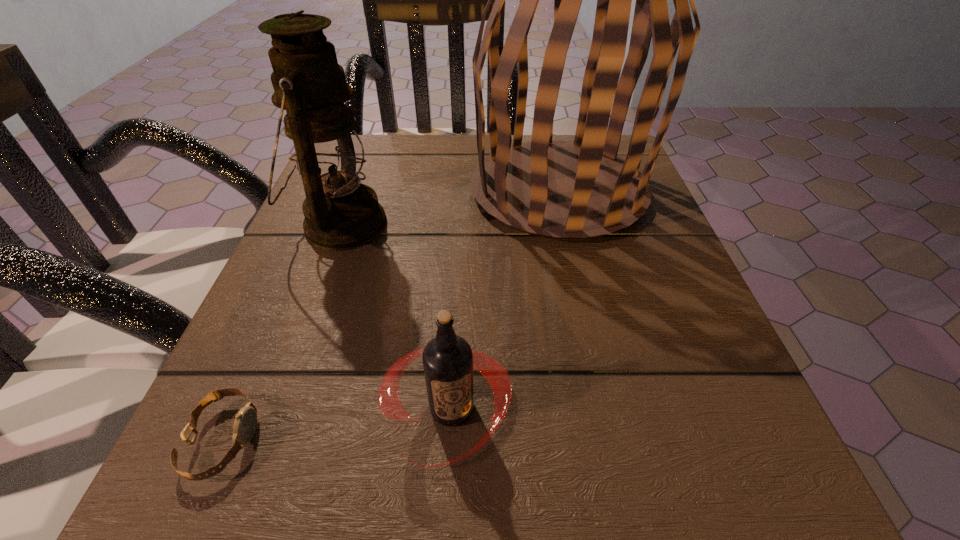
The image size is (960, 540). I want to click on the tallest object, so click(x=561, y=190).

Where is `oil lamp`? This screenshot has height=540, width=960. oil lamp is located at coordinates (341, 213).

You are a GUI agent. You are given a task and a screenshot of the screen. Output one action in this format:
    pyautogui.click(x=<x>, y=<y>)
    Task: Click on the root beer
    The width and height of the screenshot is (960, 540).
    Given the screenshot: What is the action you would take?
    pyautogui.click(x=448, y=360)

I want to click on the shortest object, so click(x=245, y=423).

Find the location of a particular element. The image size is (960, 540). free spot located on the back of the birdcage is located at coordinates (545, 134).

The height and width of the screenshot is (540, 960). In order to click on vacant space located on the front of the second tallest object in this screenshot , I will do `click(236, 508)`.

This screenshot has height=540, width=960. What are the coordinates of `vacant space located 0.250m on the face of the shortest object` in the screenshot? It's located at (469, 440).

I want to click on birdcage at the far edge, so click(x=561, y=190).

Locate an element on the screen. oil lamp located in the far edge section of the desktop is located at coordinates (341, 213).

Where is `root beer located in the near edge section of the desktop`? The height and width of the screenshot is (540, 960). root beer located in the near edge section of the desktop is located at coordinates (448, 360).